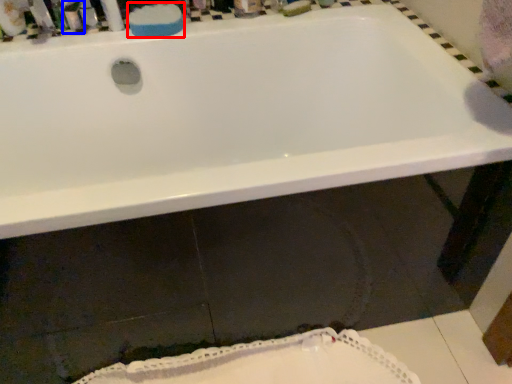
Question: Which object appears farthest to the camera in this image, soap (highlighted by a red box) or toiletry (highlighted by a blue box)?

Choices:
 (A) soap
 (B) toiletry

Answer: (A)